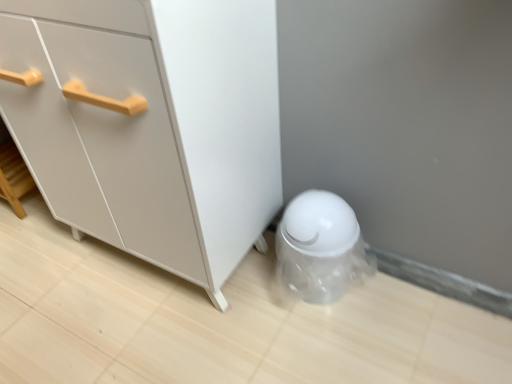
Locate an element on the screen. This screenshot has height=384, width=512. vacant area that is situated to the right of transparent plastic trash can at lower right is located at coordinates (387, 299).